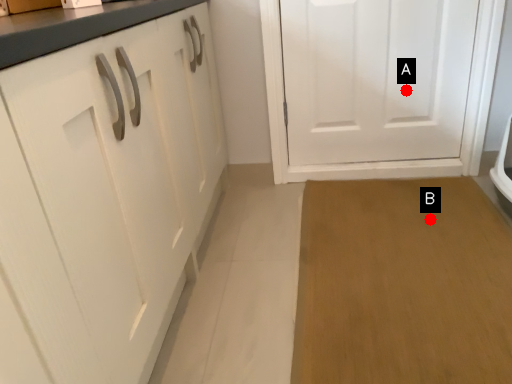
Question: Two points are circled on the image, labeled by A and B beside each circle. Which point is closer to the camera?

Choices:
 (A) A is closer
 (B) B is closer

Answer: (B)